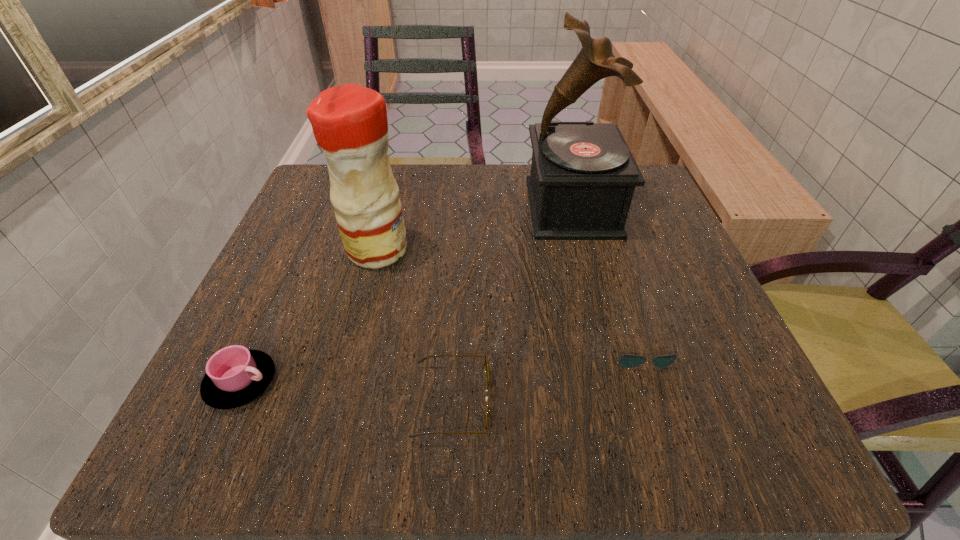
I want to click on unoccupied area between the tallest object and the shorter sunglasses, so click(606, 278).

Locate an element on the screen. free space between the cup and the taller sunglasses is located at coordinates (347, 392).

Locate an element on the screen. This screenshot has height=540, width=960. vacant area between the phonograph_record and the taller sunglasses is located at coordinates (513, 305).

The height and width of the screenshot is (540, 960). In order to click on vacant space that's between the tallest object and the third object from left to right in this screenshot , I will do `click(513, 305)`.

Where is `vacant space that's between the left sunglasses and the condiment`? The width and height of the screenshot is (960, 540). vacant space that's between the left sunglasses and the condiment is located at coordinates (415, 326).

The image size is (960, 540). What are the coordinates of `unoccupied position between the third object from left to right and the tallest object` in the screenshot? It's located at (513, 305).

Image resolution: width=960 pixels, height=540 pixels. In order to click on empty space that is in between the leftmost object and the right sunglasses in this screenshot , I will do `click(440, 365)`.

Find the location of a particular element. vacant point located between the fourth object from right to left and the cup is located at coordinates pyautogui.click(x=309, y=316).

The width and height of the screenshot is (960, 540). I want to click on vacant region between the leftmost object and the tallest object, so click(407, 295).

Locate an element on the screen. The width and height of the screenshot is (960, 540). unoccupied area between the cup and the phonograph_record is located at coordinates (407, 295).